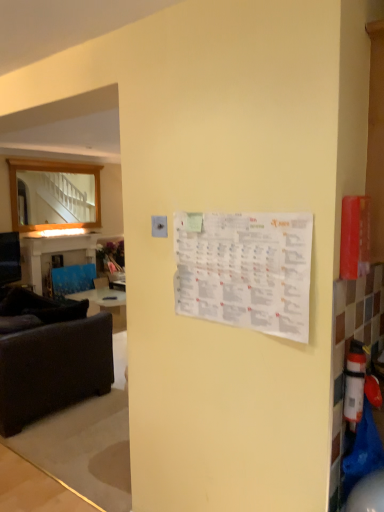
Question: Relative to dark brown fabric studio couch at left, is velvet blue armchair at left in front or behind?

Choices:
 (A) behind
 (B) front

Answer: (A)

Question: Is velvet blue armchair at left bigger or smaller than dark brown fabric studio couch at left?

Choices:
 (A) big
 (B) small

Answer: (B)

Question: Which is farther from the blue fabric table at left?

Choices:
 (A) white paper calendar at center
 (B) dark brown fabric studio couch at left
 (C) white plastic extinguisher at right
 (D) wooden frame mirror at left
 (E) velvet blue armchair at left

Answer: (C)

Question: Estimate the real-world distances between objects in this image. Which object is farther from the white plastic extinguisher at right?

Choices:
 (A) blue fabric table at left
 (B) wooden frame mirror at left
 (C) white paper calendar at center
 (D) dark brown fabric studio couch at left
 (E) velvet blue armchair at left

Answer: (B)